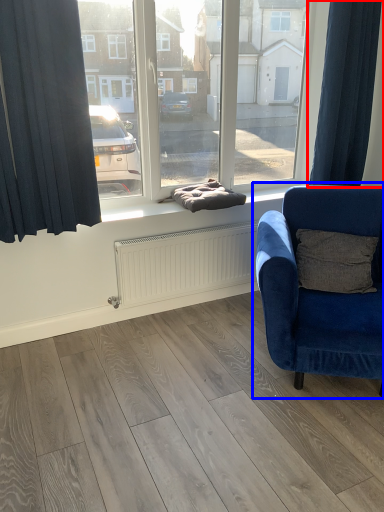
Question: Among these objects, which one is nearest to the camera, curtain (highlighted by a red box) or chair (highlighted by a blue box)?

Choices:
 (A) curtain
 (B) chair

Answer: (B)